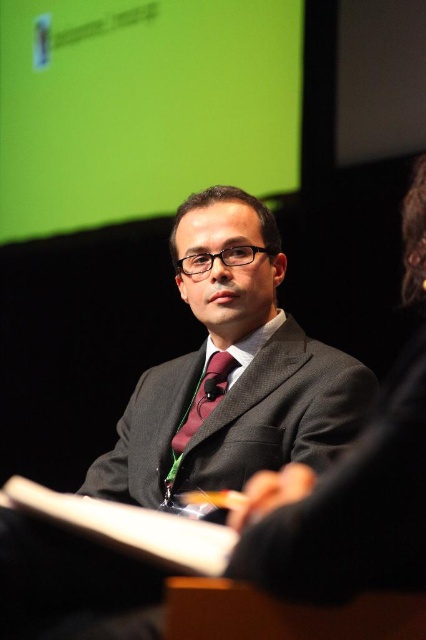
Question: Is dark gray suit at center closer to the viewer compared to maroon satin tie at center?

Choices:
 (A) yes
 (B) no

Answer: (A)

Question: Does dark gray suit at center have a greater width compared to maroon satin tie at center?

Choices:
 (A) yes
 (B) no

Answer: (A)

Question: Is dark gray suit at center in front of maroon satin tie at center?

Choices:
 (A) yes
 (B) no

Answer: (A)

Question: Which point is closer to the camera taking this photo?

Choices:
 (A) (172, 470)
 (B) (270, 289)

Answer: (A)

Question: Which point appears farthest from the camera in this image?

Choices:
 (A) 190,353
 (B) 167,492

Answer: (A)